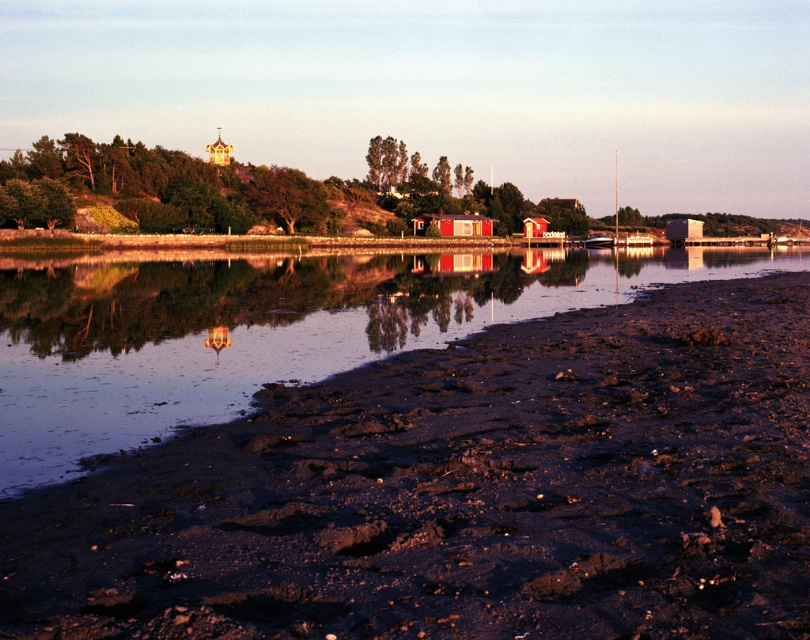
Question: Estimate the real-world distances between objects in this image. Which object is farther from the damp brown mud at lower left?

Choices:
 (A) red wooden hut at center
 (B) red wooden cabin at center

Answer: (A)

Question: Can you confirm if red wooden cabin at center is positioned above red wooden hut at center?

Choices:
 (A) no
 (B) yes

Answer: (A)

Question: Is damp brown mud at lower left positioned before red wooden hut at center?

Choices:
 (A) yes
 (B) no

Answer: (A)

Question: Which point is closer to the camera?

Choices:
 (A) damp brown mud at lower left
 (B) red wooden hut at center

Answer: (A)

Question: Is red wooden cabin at center positioned at the back of red wooden hut at center?

Choices:
 (A) no
 (B) yes

Answer: (A)

Question: Which object is closer to the camera taking this photo?

Choices:
 (A) red wooden cabin at center
 (B) damp brown mud at lower left
 (C) red wooden hut at center

Answer: (B)